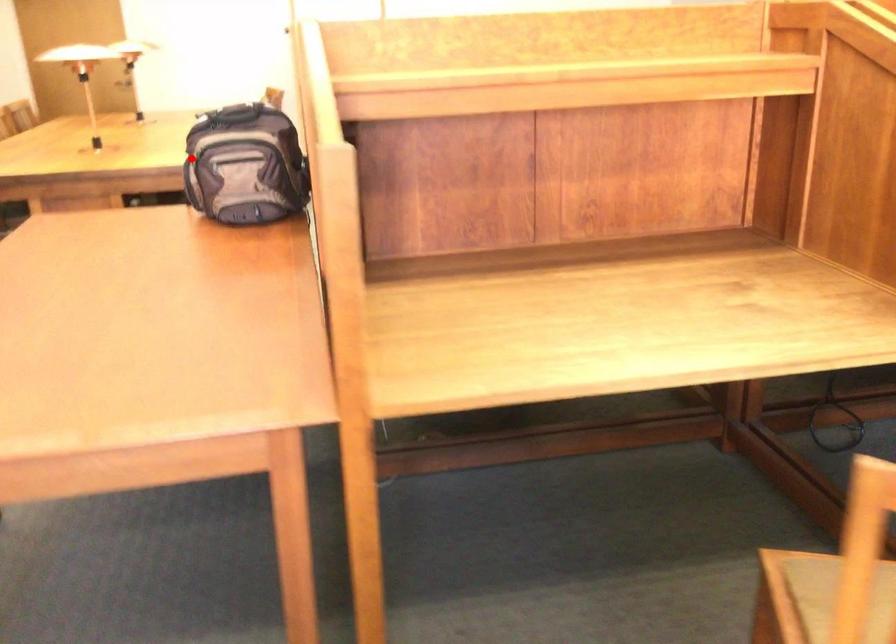
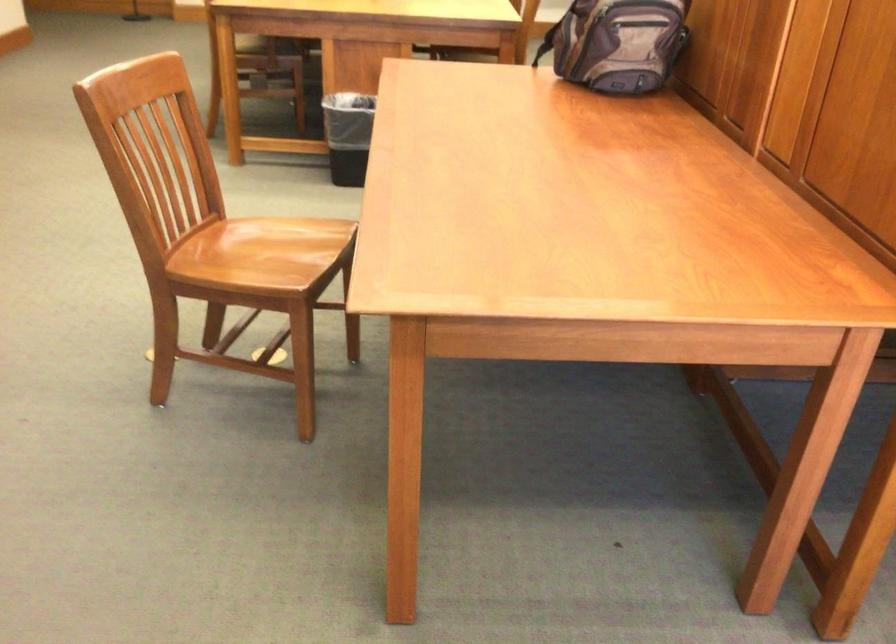
Where in the second image is the point corresponding to the highlighted location from the first image?

(582, 15)